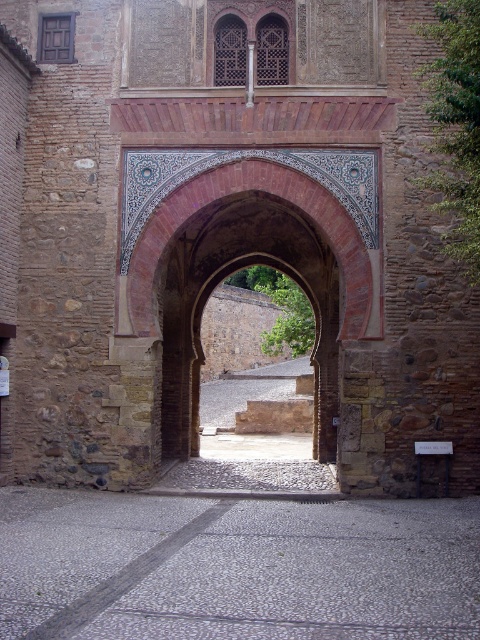
Question: Does gray stone courtyard at center appear under terracotta brick archway at center?

Choices:
 (A) no
 (B) yes

Answer: (B)

Question: Which of the following is the closest to the observer?

Choices:
 (A) terracotta brick archway at center
 (B) gray stone courtyard at center

Answer: (B)

Question: Does gray stone courtyard at center have a greater width compared to terracotta brick archway at center?

Choices:
 (A) no
 (B) yes

Answer: (B)

Question: Does gray stone courtyard at center have a lesser width compared to terracotta brick archway at center?

Choices:
 (A) no
 (B) yes

Answer: (A)